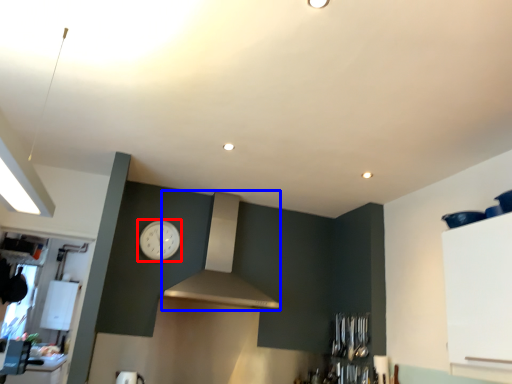
Question: Among these objects, which one is farthest to the camera, clock (highlighted by a red box) or vent (highlighted by a blue box)?

Choices:
 (A) clock
 (B) vent

Answer: (A)